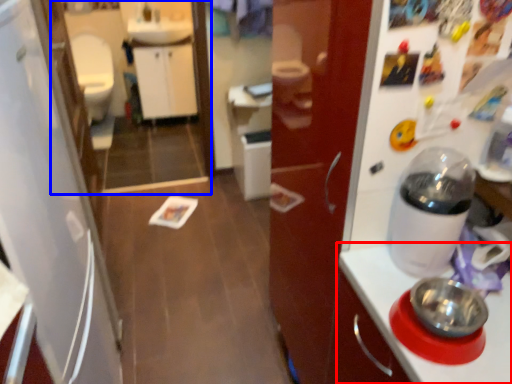
Question: Which of the following is the farthest to the observer, countertop (highlighted by a red box) or mirror (highlighted by a blue box)?

Choices:
 (A) countertop
 (B) mirror

Answer: (B)